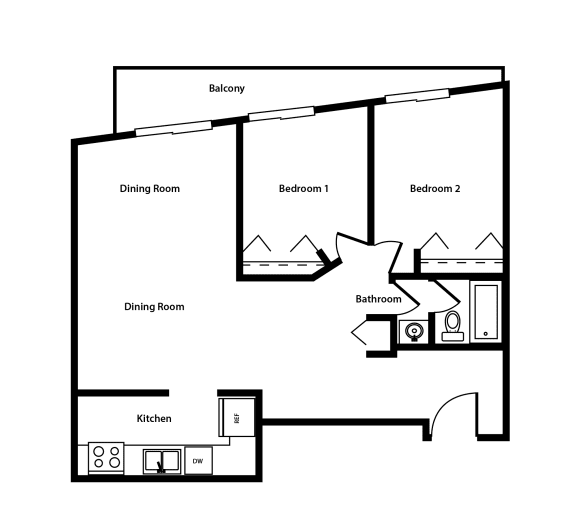
You are a GUI agent. You are given a task and a screenshot of the screen. Output one action in this format:
    pyautogui.click(x=<x>, y=<y>)
    Task: Click on the door
    
    Given the screenshot: What is the action you would take?
    pyautogui.click(x=488, y=237)